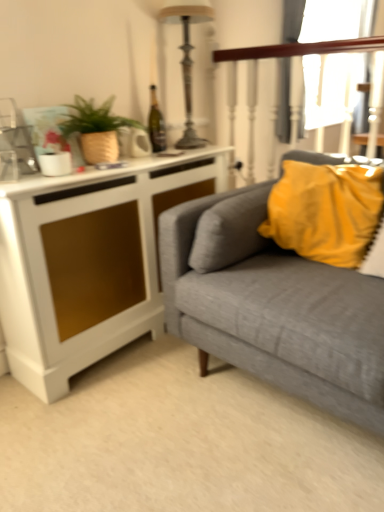
Locate an element on the screen. The image size is (384, 512). vacant area situated below metallic silver lamp at upper center (from a real-world perspective) is located at coordinates (191, 146).